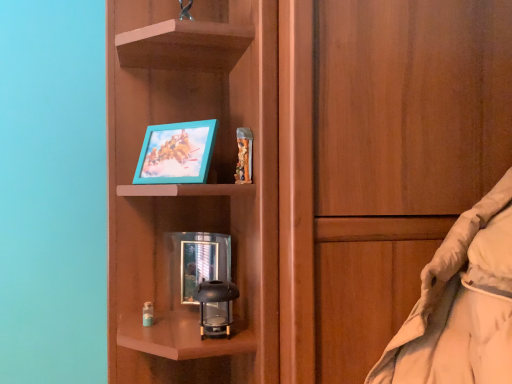
Question: From their relative heights in the image, would you say metallic reflective picture frame at center, the 2th picture frame positioned from the top, is taller or shorter than teal plastic picture frame at upper center, positioned as the 1th picture frame in top-to-bottom order?

Choices:
 (A) short
 (B) tall

Answer: (B)

Question: From a real-world perspective, is metallic reflective picture frame at center, which is the 1th picture frame from bottom to top, physically located above or below teal plastic picture frame at upper center, which ranks as the second picture frame in bottom-to-top order?

Choices:
 (A) below
 (B) above

Answer: (A)

Question: Looking at the image, does metallic reflective picture frame at center, the 2th picture frame positioned from the top, seem bigger or smaller compared to teal plastic picture frame at upper center, positioned as the 1th picture frame in top-to-bottom order?

Choices:
 (A) small
 (B) big

Answer: (A)

Question: From the image's perspective, is teal plastic picture frame at upper center, which ranks as the second picture frame in bottom-to-top order, above or below metallic reflective picture frame at center, which is the 1th picture frame from bottom to top?

Choices:
 (A) above
 (B) below

Answer: (A)

Question: From their relative heights in the image, would you say teal plastic picture frame at upper center, positioned as the 1th picture frame in top-to-bottom order, is taller or shorter than metallic reflective picture frame at center, which is the 1th picture frame from bottom to top?

Choices:
 (A) short
 (B) tall

Answer: (A)

Question: Based on their positions, is teal plastic picture frame at upper center, positioned as the 1th picture frame in top-to-bottom order, located to the left or right of metallic reflective picture frame at center, which is the 1th picture frame from bottom to top?

Choices:
 (A) right
 (B) left

Answer: (B)

Question: In terms of size, does teal plastic picture frame at upper center, which ranks as the second picture frame in bottom-to-top order, appear bigger or smaller than metallic reflective picture frame at center, the 2th picture frame positioned from the top?

Choices:
 (A) small
 (B) big

Answer: (B)